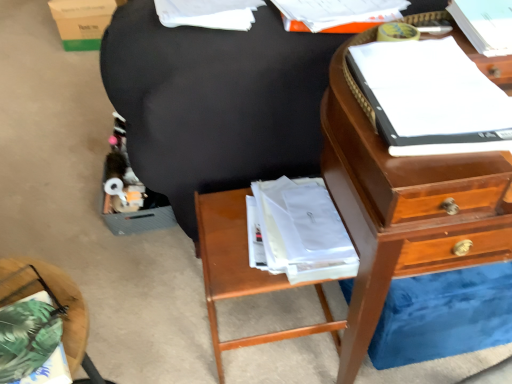
The width and height of the screenshot is (512, 384). Find the location of `free space behind green fabric pillow at lower left, the first nightstand when ordered from left to right`. free space behind green fabric pillow at lower left, the first nightstand when ordered from left to right is located at coordinates (45, 291).